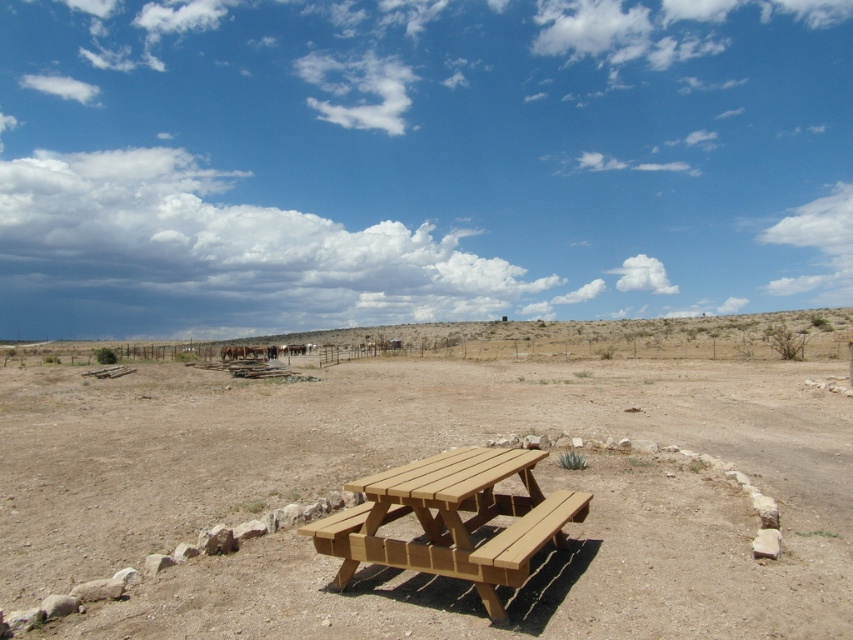
Question: Does brown wood picnic table at center have a smaller size compared to wooden picnic table at center?

Choices:
 (A) no
 (B) yes

Answer: (A)

Question: Which point is closer to the camera?

Choices:
 (A) brown wood picnic table at center
 (B) wooden picnic table at center

Answer: (B)

Question: Which point is closer to the camera?

Choices:
 (A) [222, 588]
 (B) [387, 561]

Answer: (B)

Question: Is brown wood picnic table at center smaller than wooden picnic table at center?

Choices:
 (A) no
 (B) yes

Answer: (A)

Question: Which of the following is the farthest from the observer?

Choices:
 (A) (47, 365)
 (B) (448, 541)

Answer: (A)

Question: Does brown wood picnic table at center appear on the left side of wooden picnic table at center?

Choices:
 (A) no
 (B) yes

Answer: (B)